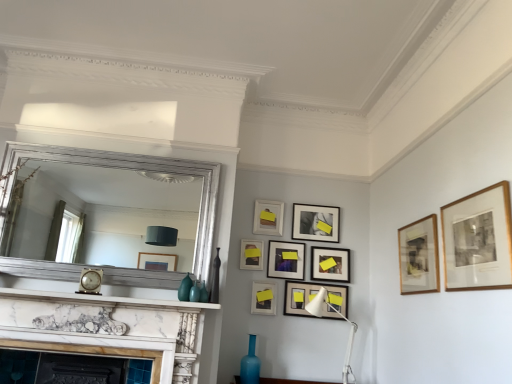
This screenshot has width=512, height=384. I want to click on black glass vase at center, which is counted as the second vase, starting from the left, so click(x=215, y=279).

In order to face wooden picture frame at upper center, which is the 2th picture frame from back to front, should I rotate leftwards or rightwards?

A 1.887 degree turn to the right will do.

Image resolution: width=512 pixels, height=384 pixels. What do you see at coordinates (104, 300) in the screenshot?
I see `marble mantel at center` at bounding box center [104, 300].

What do you see at coordinates (286, 260) in the screenshot? I see `matte black picture frame at center, the fourth picture frame from the back` at bounding box center [286, 260].

What are the coordinates of `black glass vase at center, which is counted as the second vase, starting from the left` in the screenshot? It's located at (215, 279).

Which of these two, white marble fireplace at lower left or marble mantel at center, stands shorter?

marble mantel at center is shorter.

Does white marble fireplace at lower left appear on the right side of marble mantel at center?

No, white marble fireplace at lower left is not to the right of marble mantel at center.

From a real-world perspective, which is physically below, white marble fireplace at lower left or marble mantel at center?

white marble fireplace at lower left, from a real-world perspective.

Which object is closer to the camera, metallic silver clock at center or white metal table lamp at lower center?

metallic silver clock at center is in front.

Is metallic silver clock at center at the right side of white metal table lamp at lower center?

In fact, metallic silver clock at center is to the left of white metal table lamp at lower center.

Can you tell me how much metallic silver clock at center and white metal table lamp at lower center differ in facing direction?

There is a 2.86-degree angle between the facing directions of metallic silver clock at center and white metal table lamp at lower center.

Considering the sizes of objects metallic silver clock at center and white metal table lamp at lower center in the image provided, who is wider, metallic silver clock at center or white metal table lamp at lower center?

With larger width is white metal table lamp at lower center.

Consider the image. Considering the relative sizes of matte black picture frame at center, marked as the 3th picture frame in a back-to-front arrangement, and matte black picture frame at lower center, which is the fourth picture frame in front-to-back order, in the image provided, is matte black picture frame at center, marked as the 3th picture frame in a back-to-front arrangement, taller than matte black picture frame at lower center, which is the fourth picture frame in front-to-back order,?

Yes.

From the image's perspective, is matte black picture frame at center, marked as the 3th picture frame in a back-to-front arrangement, over matte black picture frame at lower center, which is the fourth picture frame in front-to-back order?

Yes, from the image's perspective, matte black picture frame at center, marked as the 3th picture frame in a back-to-front arrangement, is on top of matte black picture frame at lower center, which is the fourth picture frame in front-to-back order.

Which object is wider, matte black picture frame at center, marked as the 3th picture frame in a back-to-front arrangement, or matte black picture frame at lower center, arranged as the sixth picture frame when viewed from the back?

With larger width is matte black picture frame at lower center, arranged as the sixth picture frame when viewed from the back.

How different are the orientations of matte black picture frame at center, marked as the 3th picture frame in a back-to-front arrangement, and matte black picture frame at lower center, arranged as the sixth picture frame when viewed from the back, in degrees?

There is a 0.0332-degree angle between the facing directions of matte black picture frame at center, marked as the 3th picture frame in a back-to-front arrangement, and matte black picture frame at lower center, arranged as the sixth picture frame when viewed from the back.

Could you measure the distance between blue glass vase at lower center, the first vase when ordered from bottom to top, and metallic silver clock at center?

blue glass vase at lower center, the first vase when ordered from bottom to top, is 1.26 meters from metallic silver clock at center.

From a real-world perspective, who is located higher, blue glass vase at lower center, which ranks as the first vase in right-to-left order, or metallic silver clock at center?

metallic silver clock at center, from a real-world perspective.

Are blue glass vase at lower center, which ranks as the first vase in right-to-left order, and metallic silver clock at center located far from each other?

Absolutely, blue glass vase at lower center, which ranks as the first vase in right-to-left order, is distant from metallic silver clock at center.

Considering the points (256, 381) and (86, 270), which point is behind, point (256, 381) or point (86, 270)?

Positioned behind is point (256, 381).

Considering the sizes of blue glass vase at lower center, marked as the third vase in a left-to-right arrangement, and silver metallic mirror at upper center in the image, is blue glass vase at lower center, marked as the third vase in a left-to-right arrangement, bigger or smaller than silver metallic mirror at upper center?

Considering their sizes, blue glass vase at lower center, marked as the third vase in a left-to-right arrangement, takes up less space than silver metallic mirror at upper center.

Between point (252, 372) and point (189, 267), which one is positioned in front?

Point (252, 372)

From a real-world perspective, is blue glass vase at lower center, marked as the third vase in a left-to-right arrangement, beneath silver metallic mirror at upper center?

Indeed, from a real-world perspective, blue glass vase at lower center, marked as the third vase in a left-to-right arrangement, is positioned beneath silver metallic mirror at upper center.

There is a matte black picture frame at center, the 6th picture frame in the front-to-back sequence. Find the location of `the 1st picture frame above it (from a real-world perspective)`. the 1st picture frame above it (from a real-world perspective) is located at coordinates (478, 240).

Can you confirm if matte black picture frame at center, the 6th picture frame in the front-to-back sequence, is taller than gold-framed print at upper right, acting as the 9th picture frame starting from the back?

No.

Which object is positioned more to the right, matte black picture frame at center, the 6th picture frame in the front-to-back sequence, or gold-framed print at upper right, acting as the 9th picture frame starting from the back?

From the viewer's perspective, gold-framed print at upper right, acting as the 9th picture frame starting from the back, appears more on the right side.

Measure the distance from matte black picture frame at center, the 6th picture frame in the front-to-back sequence, to gold-framed print at upper right, acting as the 9th picture frame starting from the back.

matte black picture frame at center, the 6th picture frame in the front-to-back sequence, is 5.29 feet from gold-framed print at upper right, acting as the 9th picture frame starting from the back.

Is matte black picture frame at center, the 6th picture frame in the front-to-back sequence, oriented away from matte black picture frame at lower center, arranged as the sixth picture frame when viewed from the back?

No, matte black picture frame at lower center, arranged as the sixth picture frame when viewed from the back, is not at the back of matte black picture frame at center, the 6th picture frame in the front-to-back sequence.

Which of these two, matte black picture frame at center, the 6th picture frame in the front-to-back sequence, or matte black picture frame at lower center, arranged as the sixth picture frame when viewed from the back, is smaller?

With smaller size is matte black picture frame at center, the 6th picture frame in the front-to-back sequence.

Which object is positioned more to the left, matte black picture frame at center, the 6th picture frame in the front-to-back sequence, or matte black picture frame at lower center, arranged as the sixth picture frame when viewed from the back?

Positioned to the left is matte black picture frame at center, the 6th picture frame in the front-to-back sequence.

The width and height of the screenshot is (512, 384). I want to click on fireplace located on the left of marble mantel at center, so click(x=108, y=328).

Identify the location of table lamp located underneath the metallic silver clock at center (from a real-world perspective). The width and height of the screenshot is (512, 384). (341, 317).

When comparing their distances from silver metallic mirror at upper center, does marble mantel at center or wooden framed artwork at upper right, which is the second picture frame from front to back, seem further?

Based on the image, wooden framed artwork at upper right, which is the second picture frame from front to back, appears to be further to silver metallic mirror at upper center.

When comparing their distances from black glass vase at center, the second vase in the right-to-left sequence, does silver metallic mirror at upper center or white marble fireplace at lower left seem closer?

Based on the image, white marble fireplace at lower left appears to be nearer to black glass vase at center, the second vase in the right-to-left sequence.

Considering their positions, is marble mantel at center positioned further to matte teal vase at center, placed as the third vase when sorted from right to left, than black glass vase at center, the second vase in the right-to-left sequence?

Based on the image, marble mantel at center appears to be further to matte teal vase at center, placed as the third vase when sorted from right to left.

Consider the image. Based on their spatial positions, is matte black picture frame at upper center, which appears as the 5th picture frame when viewed from the back, or matte teal vase at center, acting as the 2th vase starting from the top, further from wooden picture frame at upper center, which is the 2th picture frame from back to front?

matte teal vase at center, acting as the 2th vase starting from the top.

Looking at the image, which one is located further to matte black picture frame at center, acting as the seventh picture frame starting from the back, silver metallic mirror at upper center or matte black picture frame at center, the fourth picture frame from the back?

silver metallic mirror at upper center.

From the image, which object appears to be nearer to wooden picture frame at upper center, positioned as the 8th picture frame in front-to-back order, matte black picture frame at upper center, which ranks as the fifth picture frame in front-to-back order, or white marble fireplace at lower left?

Based on the image, matte black picture frame at upper center, which ranks as the fifth picture frame in front-to-back order, appears to be nearer to wooden picture frame at upper center, positioned as the 8th picture frame in front-to-back order.

Looking at the image, which one is located further to blue glass vase at lower center, the first vase when ordered from bottom to top, black glass vase at center, which is counted as the second vase, starting from the left, or matte teal vase at center, placed as the third vase when sorted from right to left?

The object further to blue glass vase at lower center, the first vase when ordered from bottom to top, is matte teal vase at center, placed as the third vase when sorted from right to left.

Estimate the real-world distances between objects in this image. Which object is closer to matte black picture frame at center, the 6th picture frame in the front-to-back sequence, gold-framed print at upper right, acting as the 9th picture frame starting from the back, or black glass vase at center, the second vase in the right-to-left sequence?

The object closer to matte black picture frame at center, the 6th picture frame in the front-to-back sequence, is black glass vase at center, the second vase in the right-to-left sequence.

Image resolution: width=512 pixels, height=384 pixels. I want to click on furniture between gold-framed print at upper right, acting as the 9th picture frame starting from the back, and matte black picture frame at center, marked as the ninth picture frame in a front-to-back arrangement, along the z-axis, so click(290, 381).

Locate an element on the screen. mantle situated between white marble fireplace at lower left and white metal table lamp at lower center from left to right is located at coordinates (104, 300).

Image resolution: width=512 pixels, height=384 pixels. Identify the location of mantle positioned between white marble fireplace at lower left and metallic silver clock at center from near to far. (104, 300).

This screenshot has width=512, height=384. Find the location of `table lamp between matte teal vase at center, which ranks as the 2th vase in bottom-to-top order, and gold-framed print at upper right, acting as the 9th picture frame starting from the back`. table lamp between matte teal vase at center, which ranks as the 2th vase in bottom-to-top order, and gold-framed print at upper right, acting as the 9th picture frame starting from the back is located at coordinates (341, 317).